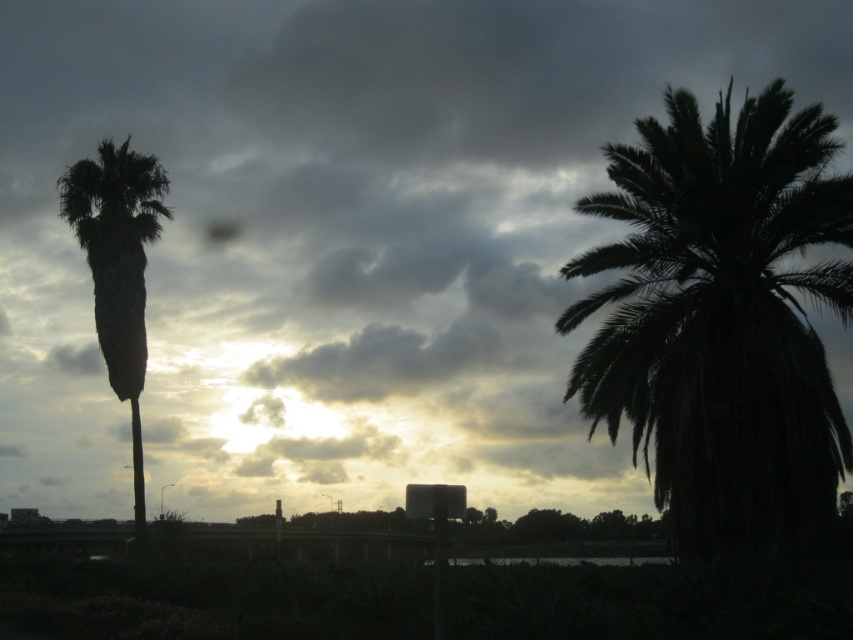
Question: Among these points, which one is farthest from the camera?

Choices:
 (A) (160, 216)
 (B) (680, 532)

Answer: (A)

Question: Considering the relative positions of dark green leafy palm at right and green leafy palm at left in the image provided, where is dark green leafy palm at right located with respect to green leafy palm at left?

Choices:
 (A) left
 (B) right

Answer: (B)

Question: Considering the relative positions of dark green leafy palm at right and green leafy palm at left in the image provided, where is dark green leafy palm at right located with respect to green leafy palm at left?

Choices:
 (A) left
 (B) right

Answer: (B)

Question: Is dark green leafy palm at right closer to camera compared to green leafy palm at left?

Choices:
 (A) yes
 (B) no

Answer: (A)

Question: Among these objects, which one is nearest to the camera?

Choices:
 (A) dark green leafy palm at right
 (B) green leafy palm at left

Answer: (A)